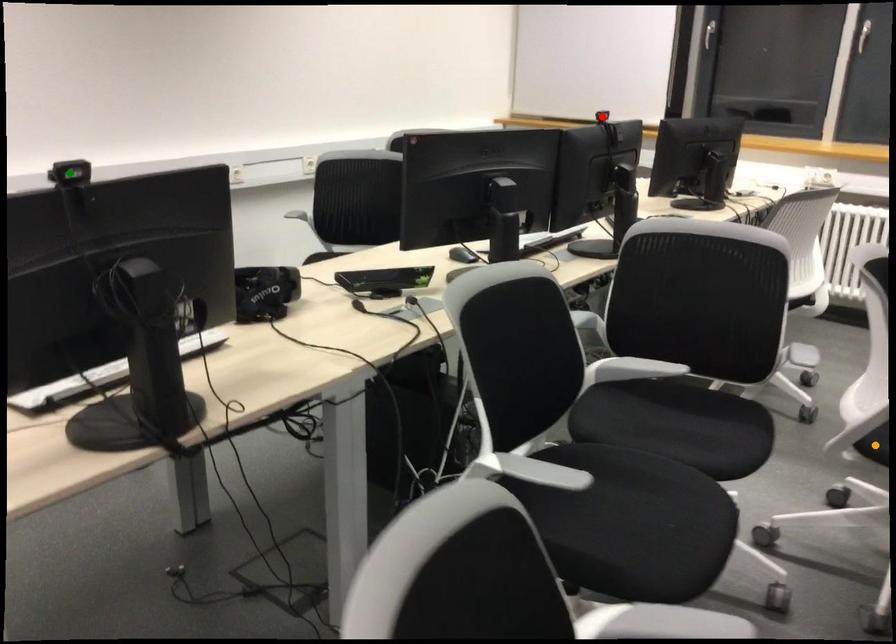
Order these from nearest to farthest:
A) red point
B) orange point
C) green point

green point, orange point, red point